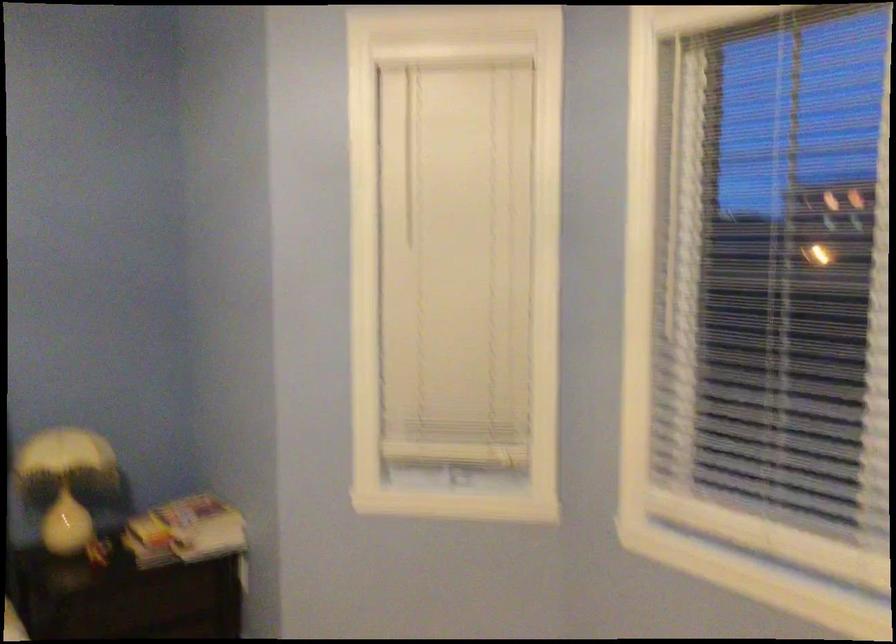
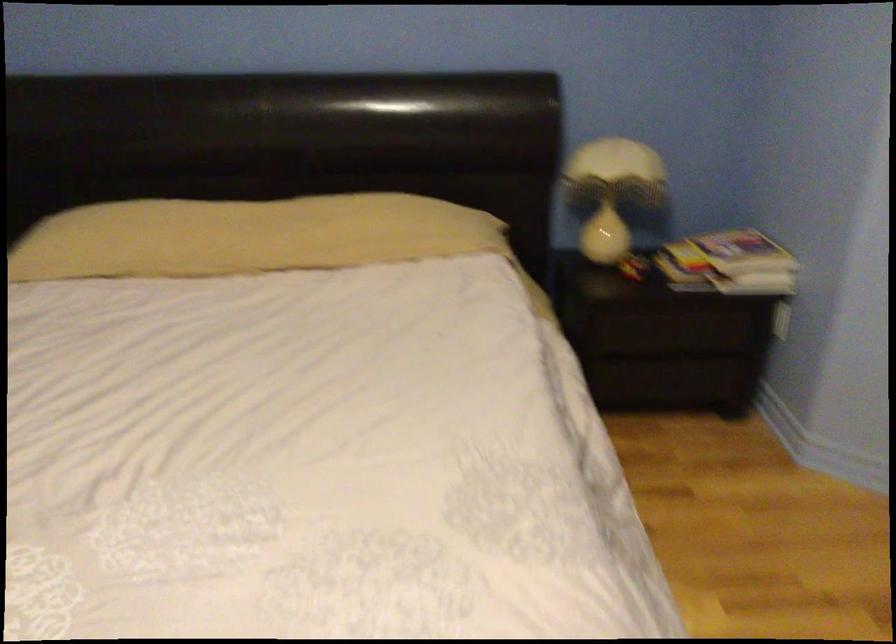
Find the pixel in the second image that matches point (73, 486) in the first image.

(613, 191)